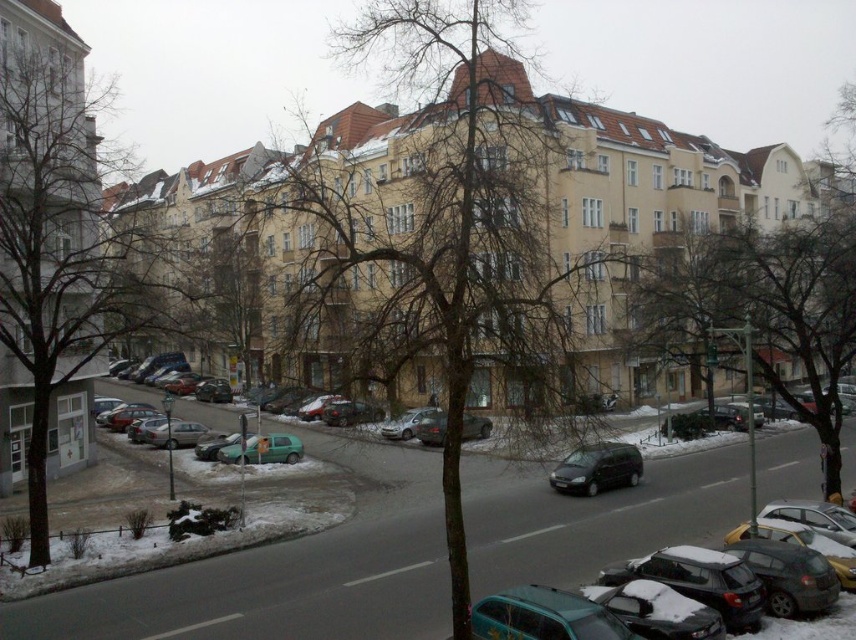
Question: Is teal matte car at lower center to the right of green matte car at center from the viewer's perspective?

Choices:
 (A) no
 (B) yes

Answer: (B)

Question: Can you confirm if brown bark tree at left is positioned to the right of bare branches at center?

Choices:
 (A) no
 (B) yes

Answer: (A)

Question: Which point appears closest to the camera in this image?

Choices:
 (A) (831, 385)
 (B) (412, 301)
 (C) (524, 634)

Answer: (B)

Question: Which point is closer to the camera?

Choices:
 (A) snow-covered car at lower right
 (B) teal matte car at lower center
 (C) bare branches at center
 (D) green matte car at center

Answer: (B)

Question: Does brown bark tree at left come behind bare branches at center?

Choices:
 (A) no
 (B) yes

Answer: (A)

Question: Which object is the farthest from the snow-covered car at lower right?

Choices:
 (A) green matte car at center
 (B) brown textured tree at center
 (C) brown bark tree at left
 (D) teal matte car at lower center

Answer: (B)